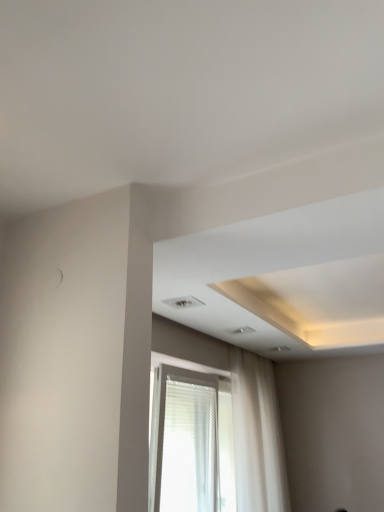
What are the coordinates of `white sheer curtain at lower center` in the screenshot? It's located at (257, 435).

What do you see at coordinates (257, 435) in the screenshot? I see `white sheer curtain at lower center` at bounding box center [257, 435].

Image resolution: width=384 pixels, height=512 pixels. What do you see at coordinates (257, 435) in the screenshot? I see `white sheer curtain at center` at bounding box center [257, 435].

Locate an element on the screen. white sheer curtain at center is located at coordinates (257, 435).

Find the location of a particular element. white sheer curtain at lower center is located at coordinates tap(257, 435).

Which object is positioned more to the left, white sheer curtain at center or white sheer curtain at lower center?

white sheer curtain at lower center.

In the image, is white sheer curtain at center positioned in front of or behind white sheer curtain at lower center?

white sheer curtain at center is behind white sheer curtain at lower center.

Does point (238, 398) come closer to viewer compared to point (251, 439)?

No.

Consider the image. From the image's perspective, does white sheer curtain at center appear higher than white sheer curtain at lower center?

Incorrect, from the image's perspective, white sheer curtain at center is lower than white sheer curtain at lower center.

From a real-world perspective, between white sheer curtain at center and white sheer curtain at lower center, who is vertically lower?

white sheer curtain at lower center, from a real-world perspective.

Between white sheer curtain at center and white sheer curtain at lower center, which one has smaller width?

With smaller width is white sheer curtain at lower center.

Who is taller, white sheer curtain at center or white sheer curtain at lower center?

white sheer curtain at center is taller.

Which of these two, white sheer curtain at center or white sheer curtain at lower center, is smaller?

white sheer curtain at center.

Is white sheer curtain at center spatially inside white sheer curtain at lower center, or outside of it?

white sheer curtain at center is spatially situated outside white sheer curtain at lower center.

Are white sheer curtain at center and white sheer curtain at lower center beside each other?

Yes.

Does white sheer curtain at center turn towards white sheer curtain at lower center?

No, white sheer curtain at center is not turned towards white sheer curtain at lower center.

Can you tell me how much white sheer curtain at center and white sheer curtain at lower center differ in facing direction?

The angular difference between white sheer curtain at center and white sheer curtain at lower center is 0.428 degrees.

Locate an element on the screen. This screenshot has height=512, width=384. window that is above the white sheer curtain at center (from the image's perspective) is located at coordinates (257, 435).

Between white sheer curtain at lower center and white sheer curtain at center, which one appears on the left side from the viewer's perspective?

white sheer curtain at lower center is more to the left.

Is white sheer curtain at lower center positioned before white sheer curtain at center?

That is True.

Does point (156, 385) come farther from viewer compared to point (231, 380)?

No, (156, 385) is in front of (231, 380).

From the image's perspective, which object appears higher, white sheer curtain at lower center or white sheer curtain at center?

white sheer curtain at lower center appears higher in the image.

From a real-world perspective, is white sheer curtain at lower center physically below white sheer curtain at center?

Yes, from a real-world perspective, white sheer curtain at lower center is beneath white sheer curtain at center.

Considering the sizes of white sheer curtain at lower center and white sheer curtain at center in the image, is white sheer curtain at lower center wider or thinner than white sheer curtain at center?

white sheer curtain at lower center is thinner than white sheer curtain at center.

Does white sheer curtain at lower center have a lesser height compared to white sheer curtain at center?

Correct, white sheer curtain at lower center is not as tall as white sheer curtain at center.

Which of these two, white sheer curtain at lower center or white sheer curtain at center, is bigger?

white sheer curtain at lower center.

Is white sheer curtain at lower center not within white sheer curtain at center?

Indeed, white sheer curtain at lower center is completely outside white sheer curtain at center.

Are white sheer curtain at lower center and white sheer curtain at center far apart?

No, there isn't a large distance between white sheer curtain at lower center and white sheer curtain at center.

Is white sheer curtain at lower center positioned with its back to white sheer curtain at center?

white sheer curtain at lower center is not turned away from white sheer curtain at center.

Identify the location of window on the left side of white sheer curtain at center. (257, 435).

Identify the location of window that is on the left side of white sheer curtain at center. (257, 435).

Locate an element on the screen. The height and width of the screenshot is (512, 384). curtain below the white sheer curtain at lower center (from the image's perspective) is located at coordinates (257, 435).